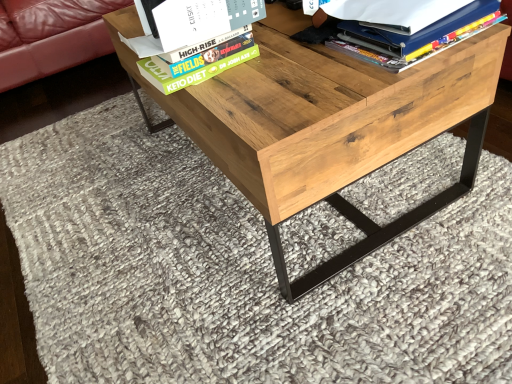
This screenshot has width=512, height=384. In order to click on free space between hardcover book at upper center and matte blue folder at upper right in this screenshot , I will do `click(282, 71)`.